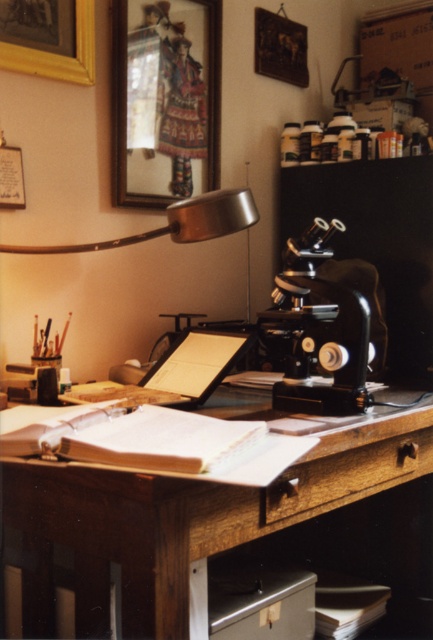
You are organizing a small party in the home office and need to place a decorative item on the desk. The gold wooden picture frame at upper left is currently hanging on the wall. Can you move it to the brown wooden table at center without removing it from its current position?

The brown wooden table at center is located below the gold wooden picture frame at upper left, so moving the frame to the table would require removing it from the wall first.

You are organizing the desk and need to move the wooden framed picture at upper left closer to the edge. If you move it forward, will it block the view of the black metal microscope at center?

The black metal microscope at center is behind the wooden framed picture at upper left, so moving the wooden framed picture at upper left forward would place it in front of the microscope, blocking its view.

What is located at the coordinates point [187,520] in the image?

The brown wooden table at center is located at point [187,520].